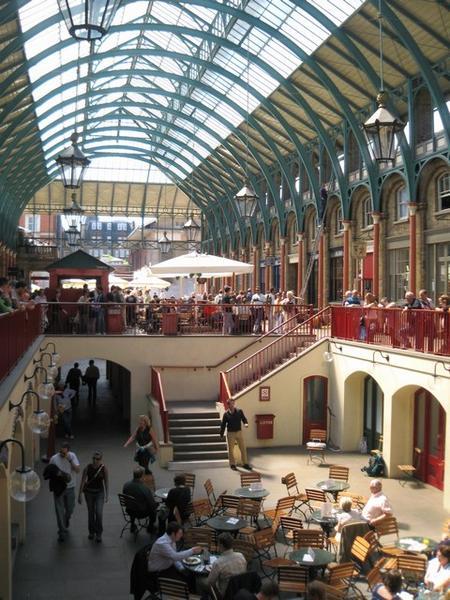
What are the coordinates of `chandeliers` in the screenshot? It's located at (381, 122), (73, 156), (74, 209), (73, 241), (252, 202), (191, 229), (163, 246).